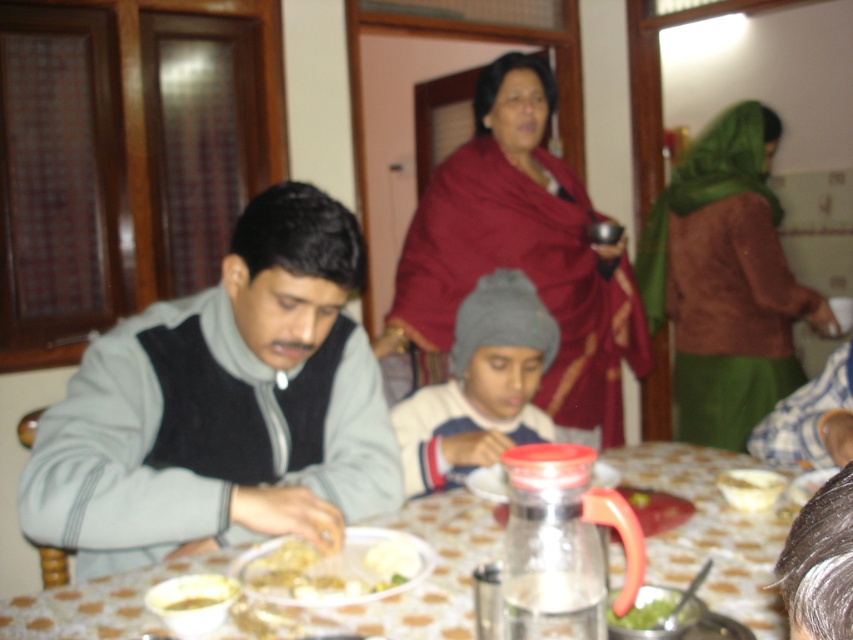
Question: Which point is farther to the camera?

Choices:
 (A) (721, 134)
 (B) (218, 577)

Answer: (A)

Question: Is yellowish matte plate at lower left below green leafy vegetable at lower center?

Choices:
 (A) no
 (B) yes

Answer: (B)

Question: Can you confirm if maroon fabric shawl at center is positioned to the right of yellowish matte food at lower center?

Choices:
 (A) yes
 (B) no

Answer: (A)

Question: Is yellowish matte plate at lower left further to camera compared to green leafy vegetable at lower center?

Choices:
 (A) yes
 (B) no

Answer: (A)

Question: Which object is the farthest from the brown textured robe at upper right?

Choices:
 (A) maroon fabric shawl at center
 (B) yellowish matte plate at lower left
 (C) gray fleece jacket at center
 (D) green leafy vegetable at lower center

Answer: (B)

Question: Estimate the real-world distances between objects in this image. Which object is closer to the translucent plastic table at lower center?

Choices:
 (A) maroon fabric shawl at center
 (B) gray fleece jacket at center

Answer: (B)